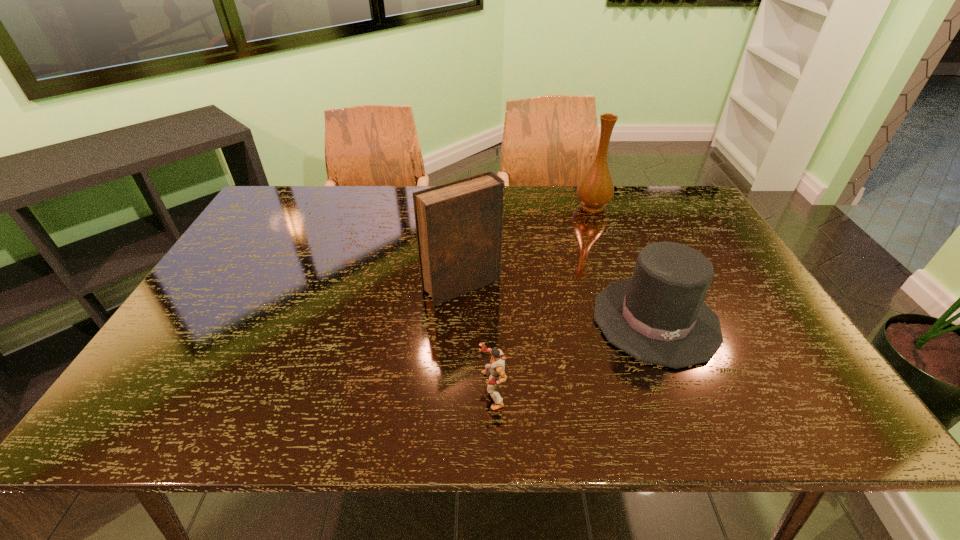
Locate which object ranks second in proximity to the third tallest object. Please provide its 2D coordinates. Your answer should be formatted as a tuple, i.e. [(x, y)], where the tuple contains the x and y coordinates of a point satisfying the conditions above.

[(495, 370)]

I want to click on blank space that satisfies the following two spatial constraints: 1. on the front of the dress hat with the decoration; 2. on the front-facing side of the shortest object, so click(684, 390).